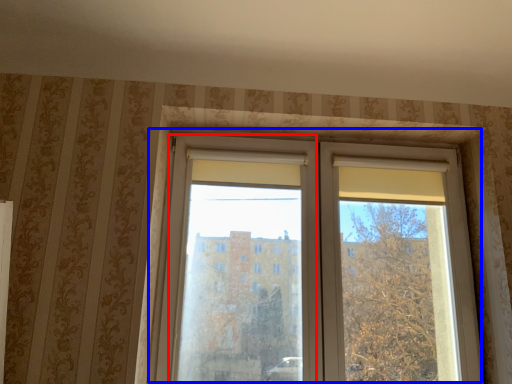
Question: Which object is closer to the camera taking this photo, screen door (highlighted by a red box) or window (highlighted by a blue box)?

Choices:
 (A) screen door
 (B) window

Answer: (A)